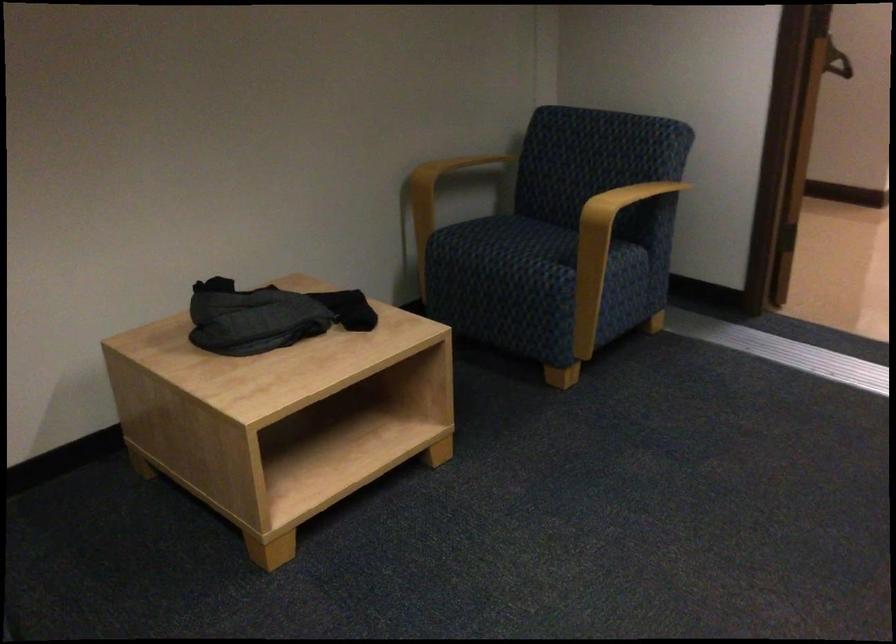
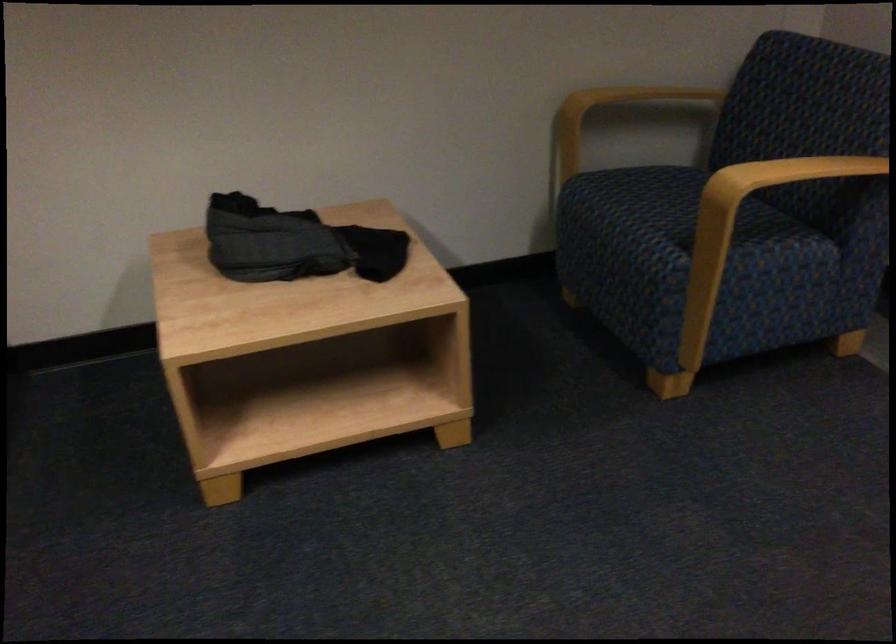
In the second image, find the point that corresponds to (x=521, y=243) in the first image.

(659, 209)